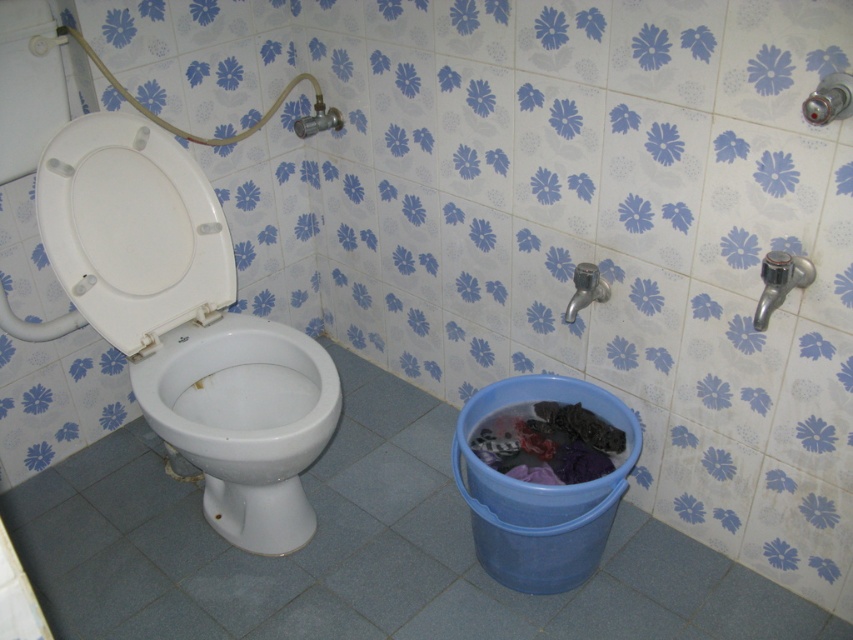
Does point (82, 188) lie in front of point (184, 452)?

No, it is not.

Which is more to the left, white plastic toilet seat at left or white glossy toilet bowl at left?

white plastic toilet seat at left is more to the left.

Is point (74, 177) positioned before point (251, 499)?

That is True.

Identify the location of white plastic toilet seat at left. The height and width of the screenshot is (640, 853). (132, 230).

Between white plastic toilet seat at left and dark fabric laundry at lower right, which one has less height?

Standing shorter between the two is dark fabric laundry at lower right.

Does white plastic toilet seat at left have a greater width compared to dark fabric laundry at lower right?

Indeed, white plastic toilet seat at left has a greater width compared to dark fabric laundry at lower right.

Is point (82, 180) positioned after point (537, 417)?

No, it is in front of (537, 417).

Where is `white plastic toilet seat at left`? white plastic toilet seat at left is located at coordinates (132, 230).

Does white glossy toilet bowl at left come behind dark fabric laundry at lower right?

No, it is not.

Between white glossy toilet bowl at left and dark fabric laundry at lower right, which one has more height?

white glossy toilet bowl at left is taller.

Locate an element on the screen. The width and height of the screenshot is (853, 640). white glossy toilet bowl at left is located at coordinates (244, 420).

This screenshot has width=853, height=640. What are the coordinates of `white glossy toilet bowl at left` in the screenshot? It's located at (244, 420).